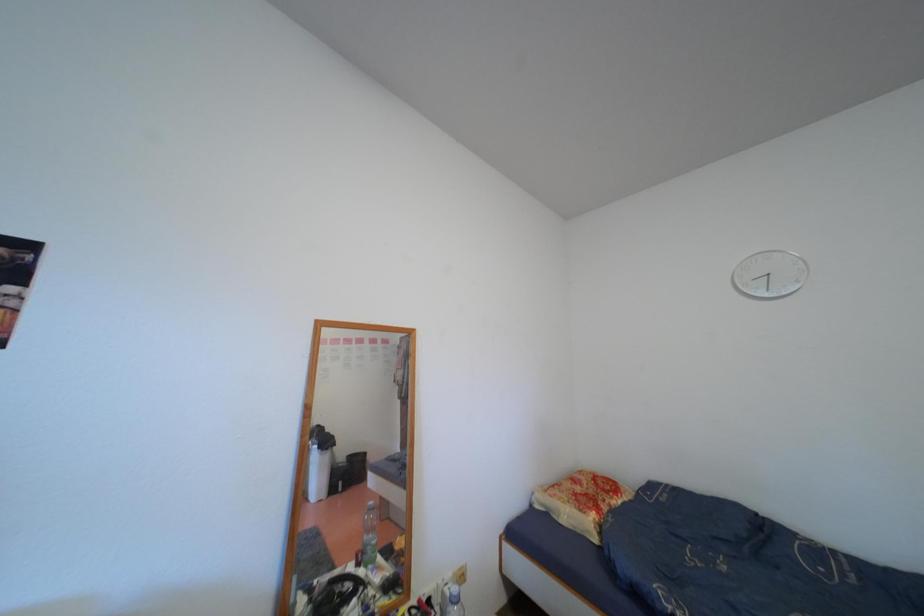
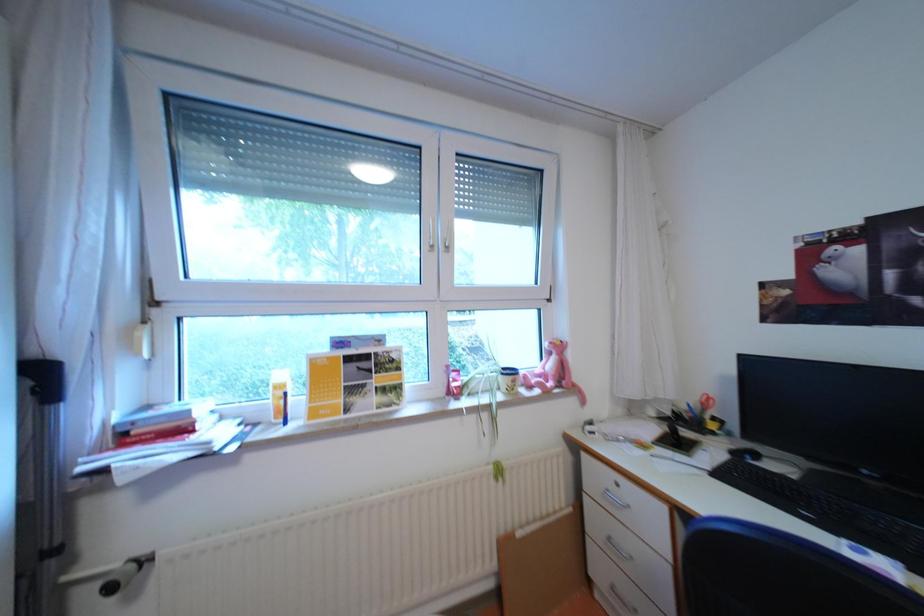
Question: The camera is either moving clockwise (left) or counter-clockwise (right) around the object. The first image is from the beginning of the video and the second image is from the end. Is the camera moving left or right when shooting the video?

Choices:
 (A) Left
 (B) Right

Answer: (B)